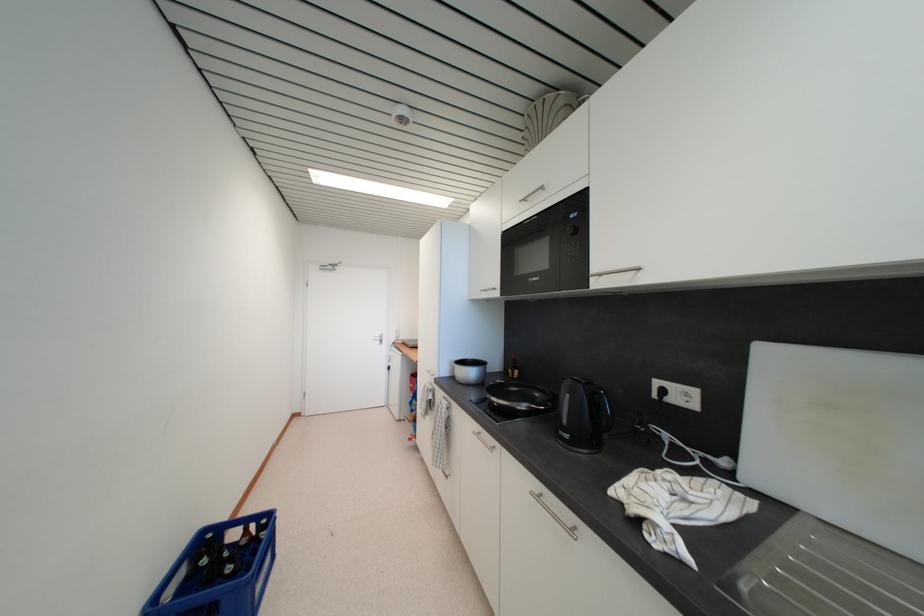
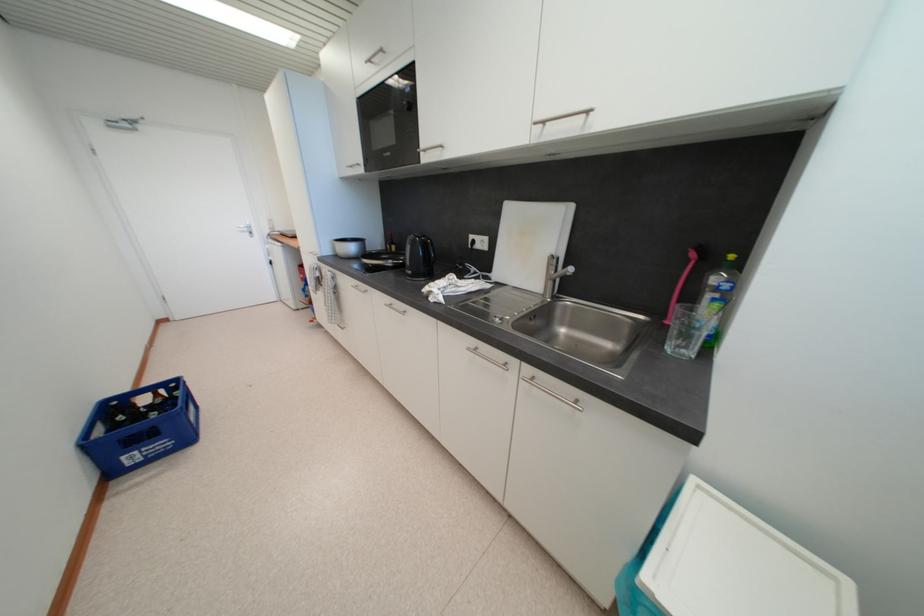
Find the pixel in the second image that matches (x=477, y=376) in the first image.

(357, 251)